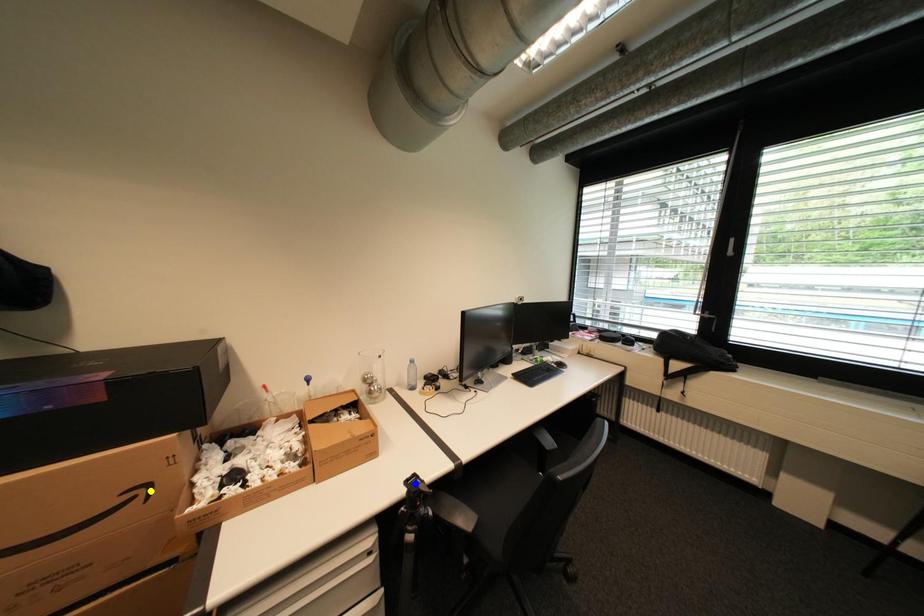
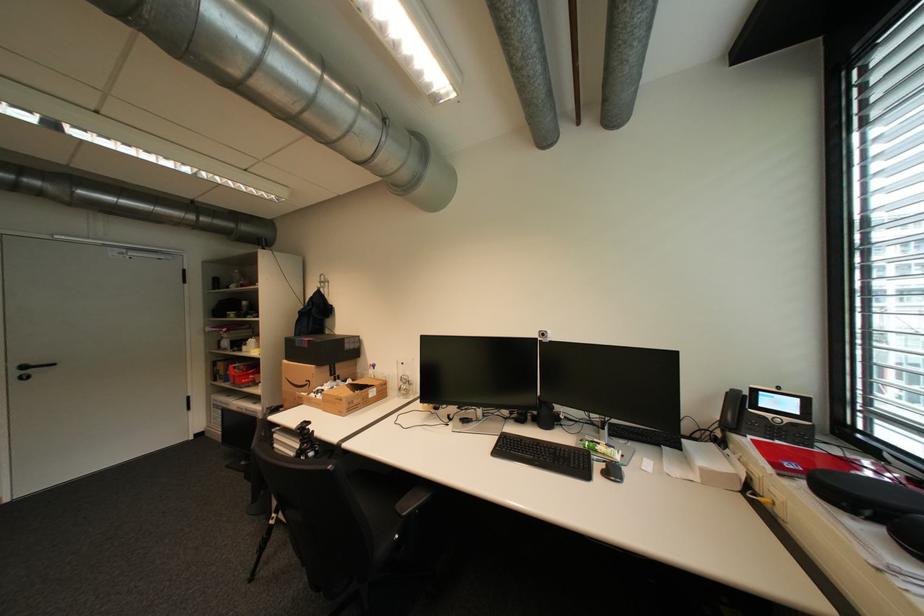
I am providing you with two images of the same scene from different viewpoints. Three points are marked in image1. Which point corresponds to a part or object that is occluded in image2?In image1, three points are marked. Which of them correspond to a part or object that is occluded in image2?Among the three points shown in image1, which one corresponds to a part or object that is no longer visible due to occlusion in image2?

blue point